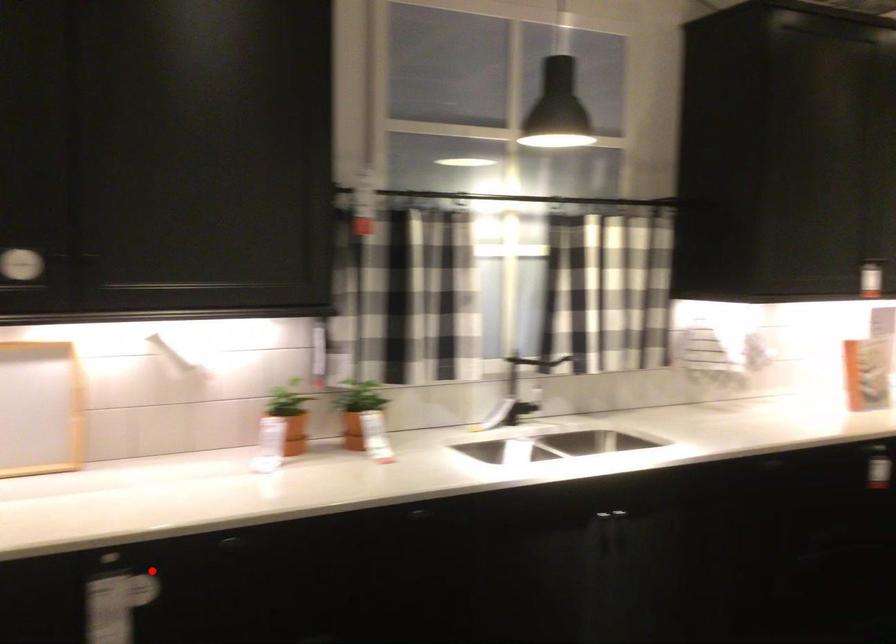
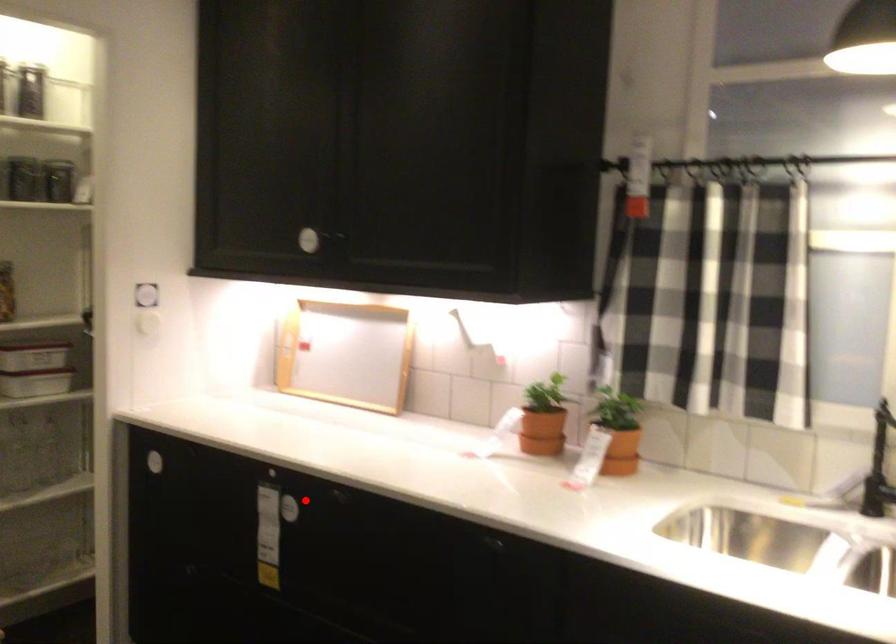
I am providing you with two images of the same scene from different viewpoints. A red point is marked on the first image and another point is marked on the second image. Is the marked point in image1 the same physical position as the marked point in image2?

Yes